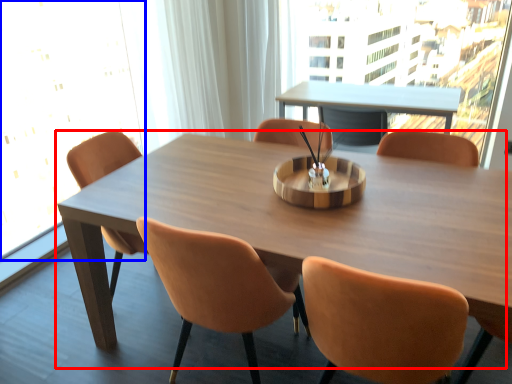
Question: Which object appears closest to the camera in this image, table (highlighted by a red box) or window screen (highlighted by a blue box)?

Choices:
 (A) table
 (B) window screen

Answer: (A)